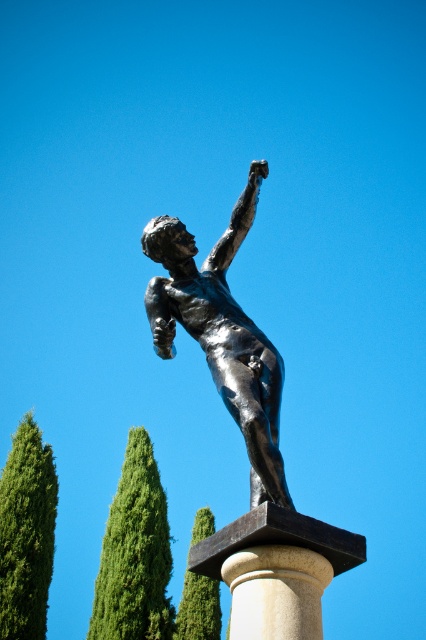
Can you confirm if green textured tree at left is bigger than green leafy tree at lower left?

Yes, green textured tree at left is bigger than green leafy tree at lower left.

Who is higher up, green textured tree at left or green leafy tree at lower left?

green textured tree at left is above.

Is point (55, 496) positioned after point (196, 632)?

No, (55, 496) is in front of (196, 632).

You are a GUI agent. You are given a task and a screenshot of the screen. Output one action in this format:
    pyautogui.click(x=<x>, y=<y>)
    Task: Click on the green textured tree at left
    
    Given the screenshot: What is the action you would take?
    pyautogui.click(x=26, y=532)

Is green leafy tree at center further to the viewer compared to green textured tree at left?

Yes, green leafy tree at center is behind green textured tree at left.

How far apart are green leafy tree at center and green textured tree at left?

5.52 meters

Between point (135, 472) and point (6, 621), which one is positioned behind?

Positioned behind is point (135, 472).

The width and height of the screenshot is (426, 640). I want to click on green leafy tree at center, so click(x=135, y=554).

Does shiny bronze statue at center appear under green leafy tree at center?

No, shiny bronze statue at center is not below green leafy tree at center.

Is point (249, 182) positioned behind point (149, 568)?

No.

What are the coordinates of `shiny bronze statue at center` in the screenshot? It's located at (221, 333).